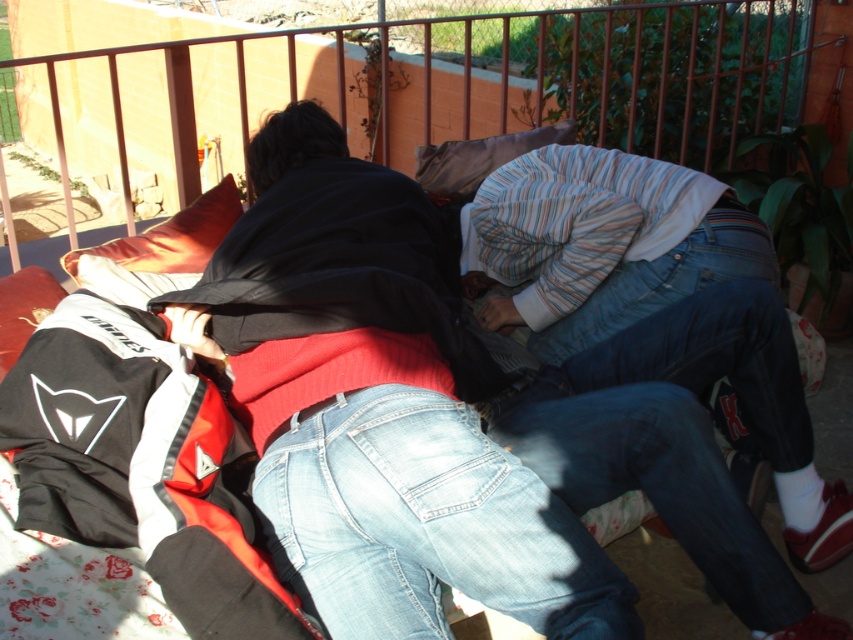
Question: Which of the following is the farthest from the observer?

Choices:
 (A) (747, 259)
 (B) (476, 173)

Answer: (B)

Question: Which point appears farthest from the camera in this image?

Choices:
 (A) (461, 200)
 (B) (650, 292)
 (C) (733, 528)

Answer: (A)

Question: Which object is farther from the camera taking this photo?

Choices:
 (A) metallic red rail at upper center
 (B) jeans at lower right
 (C) striped fabric pillow at center
 (D) light blue denim jeans at center

Answer: (C)

Question: Is jeans at lower right wider than blue denim jeans at center?

Choices:
 (A) yes
 (B) no

Answer: (B)

Question: Is metallic red rail at upper center thinner than striped cotton shirt at center?

Choices:
 (A) no
 (B) yes

Answer: (A)

Question: In this image, where is light blue denim jeans at center located relative to orange fabric pillow at upper left?

Choices:
 (A) right
 (B) left

Answer: (A)